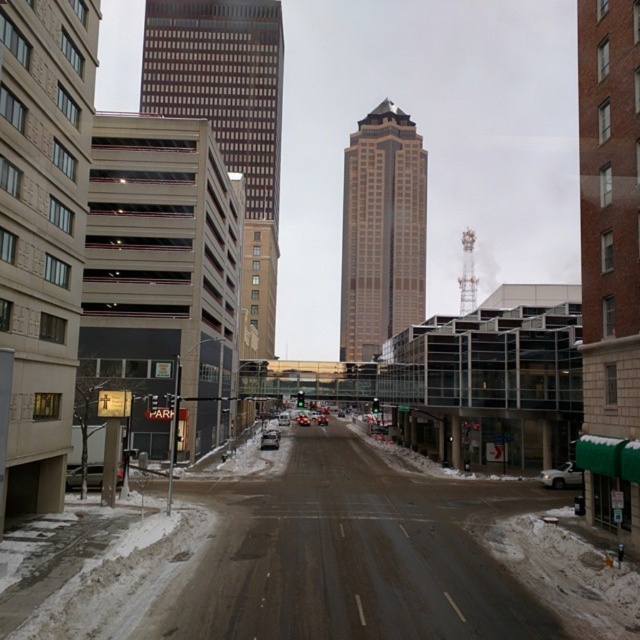
Question: Estimate the real-world distances between objects in this image. Which object is farther from the silver metallic sedan at lower left?

Choices:
 (A) brown glass skyscraper at center
 (B) shiny red sedan at center
 (C) white matte car at lower right

Answer: (A)

Question: Considering the relative positions of silver metallic sedan at center and shiny red sedan at center in the image provided, where is silver metallic sedan at center located with respect to shiny red sedan at center?

Choices:
 (A) right
 (B) left

Answer: (B)

Question: Which object is farther from the camera taking this photo?

Choices:
 (A) silver metallic sedan at lower left
 (B) brown glass skyscraper at center
 (C) gold glass skyscraper at center

Answer: (C)

Question: Is brown glass skyscraper at center further to camera compared to white matte car at lower right?

Choices:
 (A) no
 (B) yes

Answer: (B)

Question: Which of these objects is positioned farthest from the silver metallic sedan at lower left?

Choices:
 (A) white matte car at lower right
 (B) silver metallic sedan at center
 (C) shiny red sedan at center
 (D) gold glass skyscraper at center

Answer: (D)

Question: Is silver metallic sedan at lower left further to the viewer compared to silver metallic sedan at center?

Choices:
 (A) yes
 (B) no

Answer: (B)